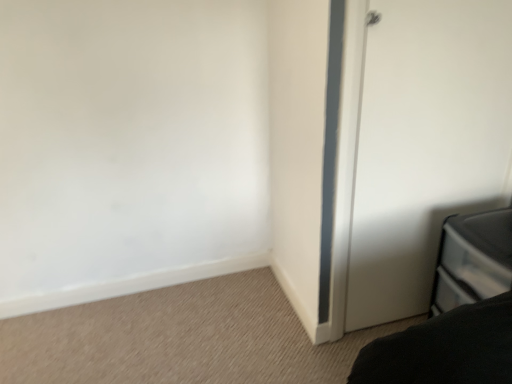
Question: Does black plastic drawer at lower right have a greater height compared to white matte door at right?

Choices:
 (A) yes
 (B) no

Answer: (B)

Question: Is black plastic drawer at lower right wider than white matte door at right?

Choices:
 (A) no
 (B) yes

Answer: (B)

Question: From the image's perspective, would you say black plastic drawer at lower right is shown under white matte door at right?

Choices:
 (A) yes
 (B) no

Answer: (A)

Question: Does black plastic drawer at lower right come in front of white matte door at right?

Choices:
 (A) no
 (B) yes

Answer: (B)

Question: Is white matte door at right completely or partially inside black plastic drawer at lower right?

Choices:
 (A) no
 (B) yes

Answer: (A)

Question: Considering the relative sizes of black plastic drawer at lower right and white matte door at right in the image provided, is black plastic drawer at lower right thinner than white matte door at right?

Choices:
 (A) no
 (B) yes

Answer: (A)

Question: Can you confirm if white matte door at right is wider than black plastic drawer at lower right?

Choices:
 (A) yes
 (B) no

Answer: (B)

Question: Is white matte door at right thinner than black plastic drawer at lower right?

Choices:
 (A) yes
 (B) no

Answer: (A)

Question: From a real-world perspective, is white matte door at right physically above black plastic drawer at lower right?

Choices:
 (A) yes
 (B) no

Answer: (A)

Question: Does white matte door at right turn towards black plastic drawer at lower right?

Choices:
 (A) yes
 (B) no

Answer: (A)

Question: Considering the relative sizes of white matte door at right and black plastic drawer at lower right in the image provided, is white matte door at right shorter than black plastic drawer at lower right?

Choices:
 (A) no
 (B) yes

Answer: (A)

Question: Would you say white matte door at right is outside black plastic drawer at lower right?

Choices:
 (A) no
 (B) yes

Answer: (B)

Question: From the image's perspective, relative to black plastic drawer at lower right, is white matte door at right above or below?

Choices:
 (A) above
 (B) below

Answer: (A)